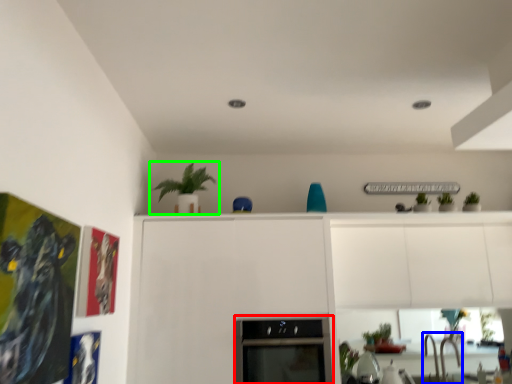
Question: Which object is positioned closest to oven (highlighted by a red box)? Select from sink (highlighted by a blue box) and houseplant (highlighted by a green box).

Choices:
 (A) sink
 (B) houseplant

Answer: (B)